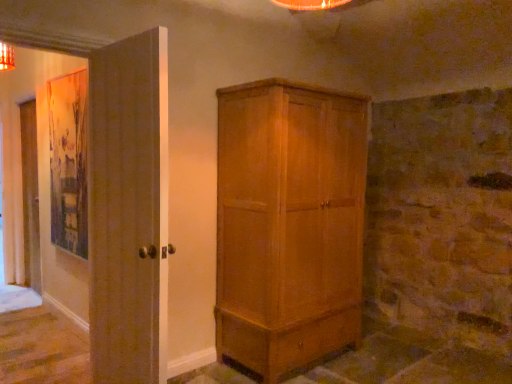
Question: Is the depth of matte brown door at left less than that of light brown wood cupboard at center?

Choices:
 (A) yes
 (B) no

Answer: (A)

Question: Can you confirm if matte brown door at left is positioned to the right of light brown wood cupboard at center?

Choices:
 (A) yes
 (B) no

Answer: (B)

Question: Can you confirm if matte brown door at left is taller than light brown wood cupboard at center?

Choices:
 (A) yes
 (B) no

Answer: (B)

Question: From the image's perspective, does matte brown door at left appear higher than light brown wood cupboard at center?

Choices:
 (A) no
 (B) yes

Answer: (B)

Question: Is matte brown door at left looking in the opposite direction of light brown wood cupboard at center?

Choices:
 (A) yes
 (B) no

Answer: (A)

Question: Can you confirm if matte brown door at left is smaller than light brown wood cupboard at center?

Choices:
 (A) yes
 (B) no

Answer: (A)

Question: Is light brown wood cupboard at center aimed at matte brown door at left?

Choices:
 (A) no
 (B) yes

Answer: (A)

Question: Is light brown wood cupboard at center wider than matte brown door at left?

Choices:
 (A) no
 (B) yes

Answer: (B)

Question: Would you say light brown wood cupboard at center is a long distance from matte brown door at left?

Choices:
 (A) no
 (B) yes

Answer: (B)

Question: Does light brown wood cupboard at center have a lesser width compared to matte brown door at left?

Choices:
 (A) yes
 (B) no

Answer: (B)

Question: Does light brown wood cupboard at center have a larger size compared to matte brown door at left?

Choices:
 (A) no
 (B) yes

Answer: (B)

Question: From a real-world perspective, is light brown wood cupboard at center physically above matte brown door at left?

Choices:
 (A) no
 (B) yes

Answer: (A)

Question: From a real-world perspective, relative to light brown wood cupboard at center, is matte brown door at left vertically above or below?

Choices:
 (A) below
 (B) above

Answer: (B)